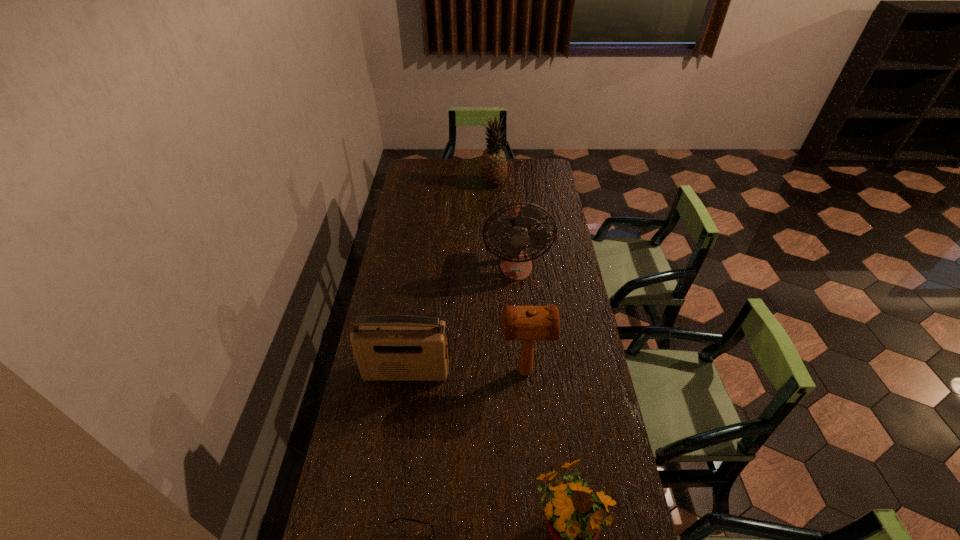
Locate an element on the screen. pineapple is located at coordinates (493, 165).

Identify the location of fan. (515, 264).

Image resolution: width=960 pixels, height=540 pixels. Identify the location of mallet. (528, 323).

You are a GUI agent. You are given a task and a screenshot of the screen. Output one action in this format:
    pyautogui.click(x=<x>, y=<y>)
    Task: Click on the radio receiver
    
    Given the screenshot: What is the action you would take?
    pyautogui.click(x=387, y=347)

This screenshot has height=540, width=960. Identify the location of free space located 0.190m on the back of the farthest object. (492, 160).

Find the location of a particular element. The image size is (960, 540). blank area located in front of the fan to direct airflow is located at coordinates (518, 293).

You are a GUI agent. You are given a task and a screenshot of the screen. Output one action in this format:
    pyautogui.click(x=<x>, y=<y>)
    Task: Click on the vacant space located 0.170m on the strike surface of the mallet
    The width and height of the screenshot is (960, 540).
    Given the screenshot: What is the action you would take?
    pyautogui.click(x=449, y=372)

At what (x,y) coordinates should I click in order to perform the action: click on vacant space located 0.150m on the strike surface of the mallet. Please return your answer as a coordinate pair (x, y). The image size is (960, 540). Looking at the image, I should click on (455, 372).

Identify the location of free space located on the strike surface of the mallet. Image resolution: width=960 pixels, height=540 pixels. (432, 372).

Where is `free space located on the front-facing side of the radio receiver`? This screenshot has height=540, width=960. free space located on the front-facing side of the radio receiver is located at coordinates (401, 411).